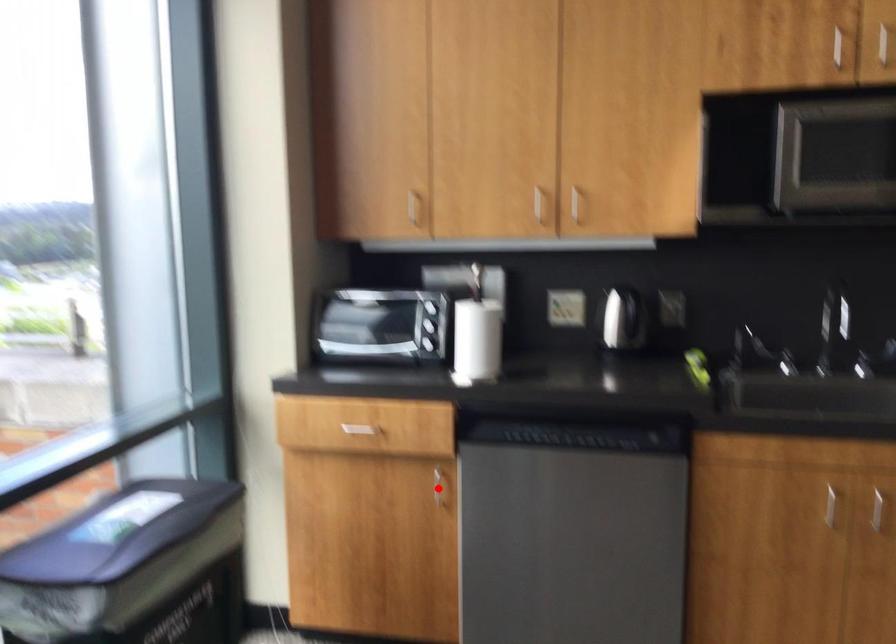
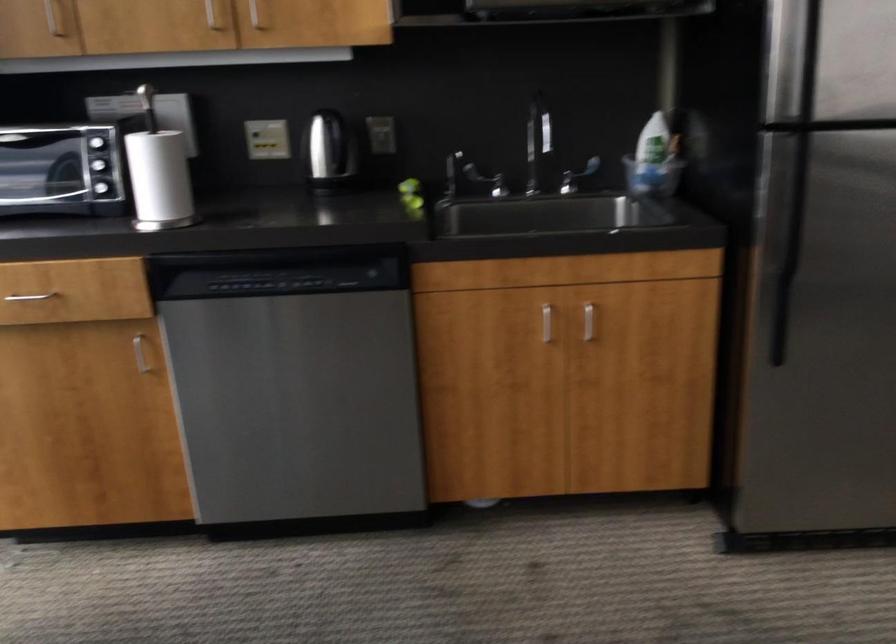
Question: I am providing you with two images of the same scene from different viewpoints. Given a red point in image1, look at the same physical point in image2. Is it:

Choices:
 (A) Closer to the viewpoint
 (B) Farther from the viewpoint

Answer: (A)